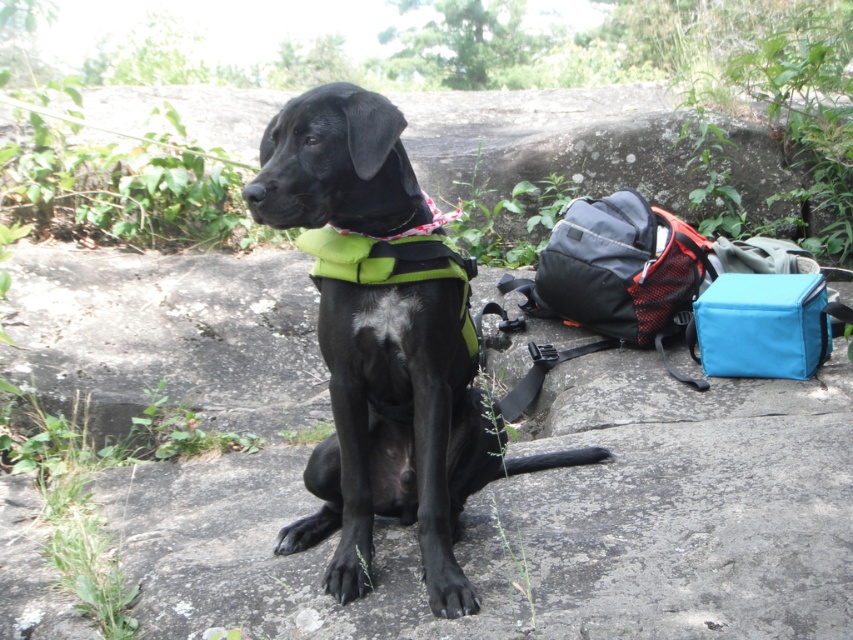
Question: Among these points, which one is nearest to the camera?

Choices:
 (A) (349, 232)
 (B) (329, 340)

Answer: (A)

Question: Is shiny black dog at center below red plaid neckband at center?

Choices:
 (A) no
 (B) yes

Answer: (B)

Question: Which point appears closest to the camera in this image?

Choices:
 (A) (281, 227)
 (B) (409, 236)

Answer: (A)

Question: From the image, what is the correct spatial relationship of shiny black dog at center in relation to red plaid neckband at center?

Choices:
 (A) right
 (B) left

Answer: (A)

Question: Which point is farther to the camera?

Choices:
 (A) (450, 216)
 (B) (437, 321)

Answer: (A)

Question: Is shiny black dog at center wider than red plaid neckband at center?

Choices:
 (A) yes
 (B) no

Answer: (A)